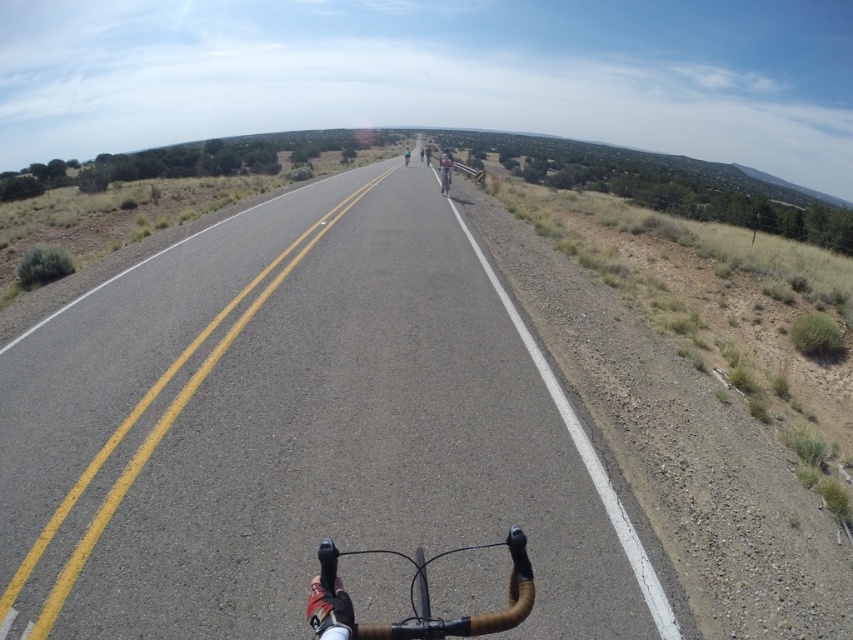
Question: Which point appears farthest from the camera in this image?

Choices:
 (A) (430, 156)
 (B) (440, 173)
 (C) (183, 518)
 (D) (408, 157)

Answer: (A)

Question: Does asphalt road at center have a larger size compared to dark blue jersey at center?

Choices:
 (A) yes
 (B) no

Answer: (B)

Question: Does black matte helmet at center have a greater width compared to dark blue jersey at center?

Choices:
 (A) no
 (B) yes

Answer: (B)

Question: Does dark blue jersey at center lie behind light blue fabric cyclist at center?

Choices:
 (A) yes
 (B) no

Answer: (A)

Question: Which point appears closest to the camera in this image?

Choices:
 (A) (518, 577)
 (B) (4, 630)

Answer: (A)

Question: Which object is positioned farthest from the shiny silver bicycle at center?

Choices:
 (A) brown leather handlebars at center
 (B) black matte helmet at center

Answer: (A)